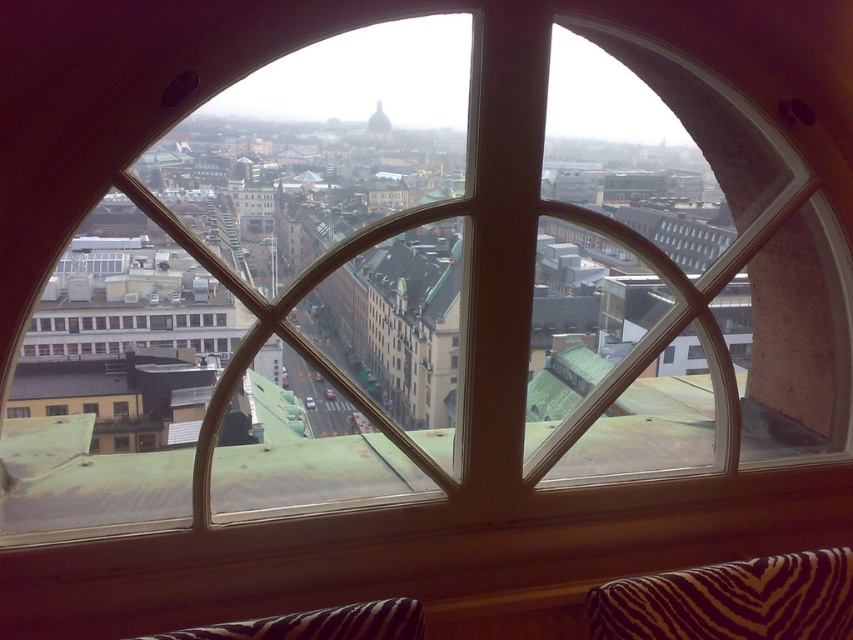
Question: Which object is closer to the camera taking this photo?

Choices:
 (A) zebra print fabric pillow at lower right
 (B) transparent glass window at center

Answer: (A)

Question: Does zebra print fabric pillow at lower right have a larger size compared to zebra print fabric pillow at lower center?

Choices:
 (A) no
 (B) yes

Answer: (B)

Question: Does zebra print fabric pillow at lower center appear on the right side of transparent glass window at center?

Choices:
 (A) no
 (B) yes

Answer: (B)

Question: Which object is the farthest from the zebra print fabric pillow at lower right?

Choices:
 (A) zebra print fabric pillow at lower center
 (B) transparent glass window at center

Answer: (B)

Question: Does zebra print fabric pillow at lower right lie in front of zebra print fabric pillow at lower center?

Choices:
 (A) no
 (B) yes

Answer: (A)

Question: Estimate the real-world distances between objects in this image. Which object is closer to the transparent glass window at center?

Choices:
 (A) zebra print fabric pillow at lower right
 (B) zebra print fabric pillow at lower center

Answer: (B)